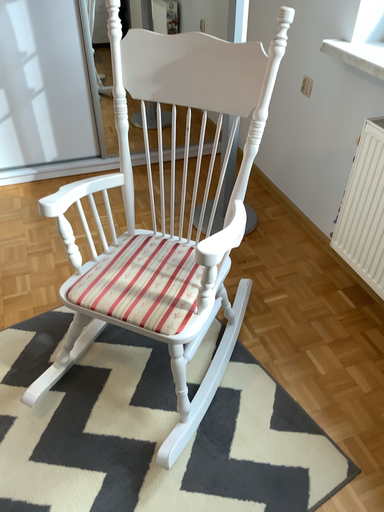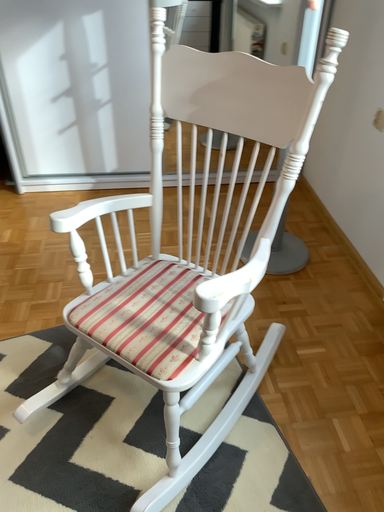
Question: How did the camera likely rotate when shooting the video?

Choices:
 (A) rotated right
 (B) rotated left

Answer: (B)